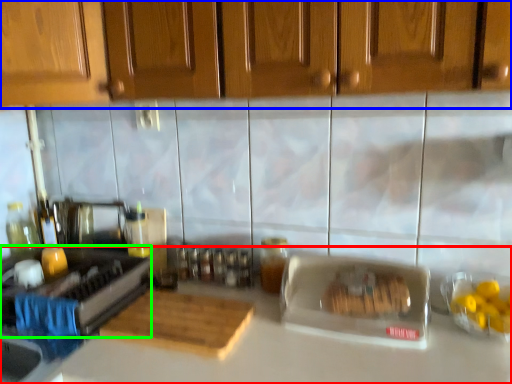
Question: Considering the real-world distances, which object is farthest from countertop (highlighted by a red box)? cabinetry (highlighted by a blue box) or appliance (highlighted by a green box)?

Choices:
 (A) cabinetry
 (B) appliance

Answer: (A)